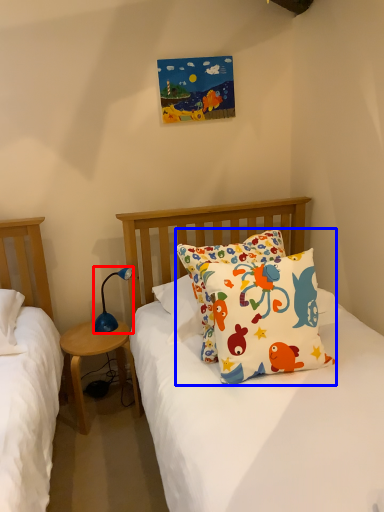
Question: Among these objects, which one is nearest to the camera, lamp (highlighted by a red box) or pillow (highlighted by a blue box)?

Choices:
 (A) lamp
 (B) pillow

Answer: (B)